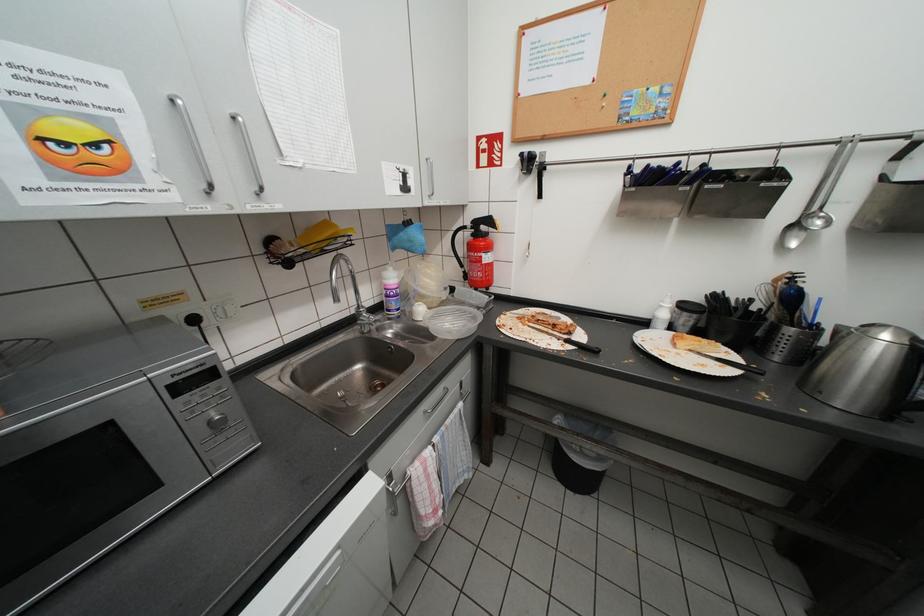
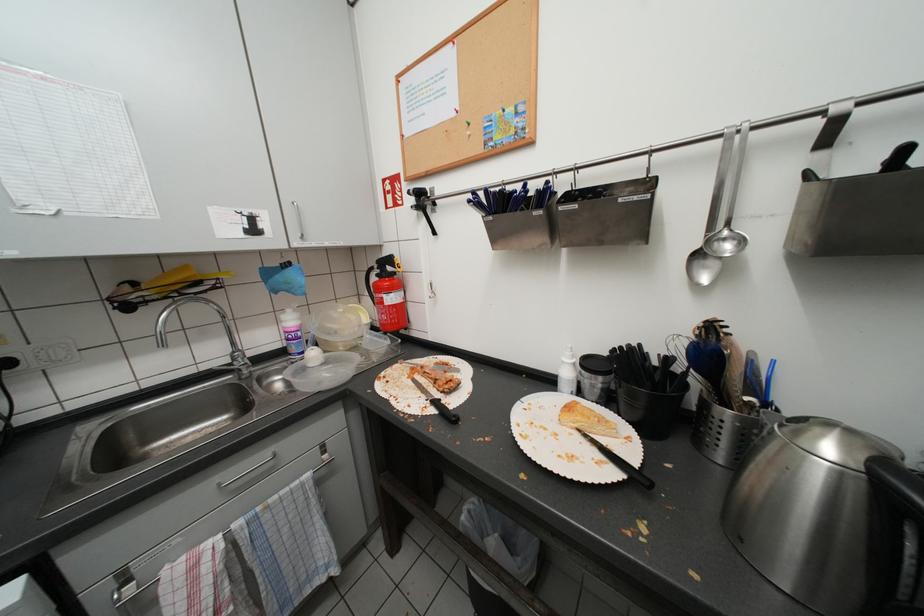
Question: What movement of the cameraman would produce the second image?

Choices:
 (A) Left
 (B) Right
 (C) Forward
 (D) Backward

Answer: (B)